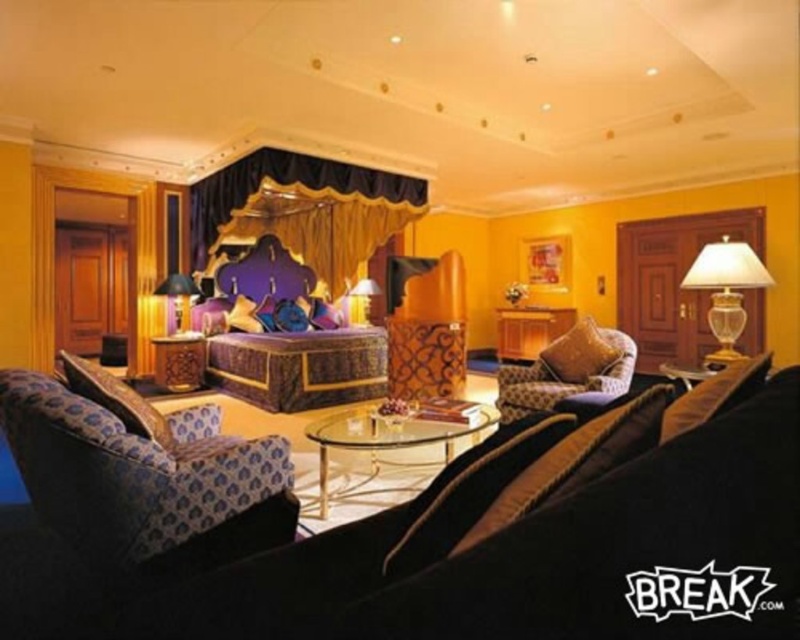
You are a guest in this luxurious suite and want to sit in the patterned fabric armchair at center while also reaching the translucent glass lampshade at right to adjust its light. Based on their positions, can you easily move from the armchair to the lampshade without needing to go around any furniture?

The patterned fabric armchair at center is to the left of the translucent glass lampshade at right, so there is a clear path between them. You can easily move from the armchair to the lampshade directly without needing to go around any furniture.

You are a guest in this luxurious suite and want to sit down. You see a patterned fabric armchair at center and a matte gold lamp at center. Which object is positioned to the right of the other?

The patterned fabric armchair at center is to the right of the matte gold lamp at center.

You are a guest in this luxurious suite and want to sit down. You see the patterned fabric armchair at lower left and the purple velvet curtain at center. Which one is shorter?

The patterned fabric armchair at lower left is shorter than the purple velvet curtain at center.